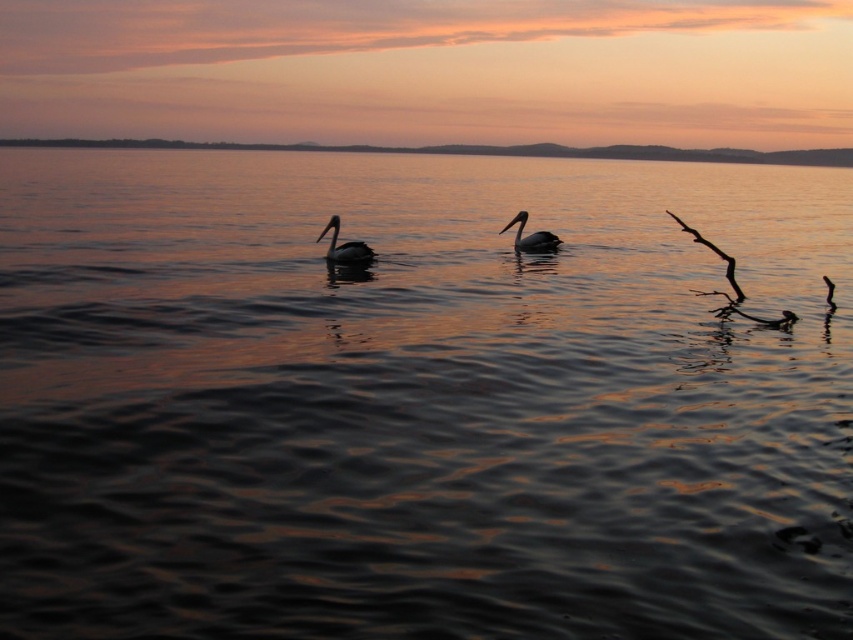
Identify the location of dark gray matte pelican at center. The image size is (853, 640). (344, 246).

Does dark gray matte pelican at center come behind matte gray duck at center?

That is False.

Is point (328, 228) positioned after point (523, 225)?

No, (328, 228) is in front of (523, 225).

Where is `dark gray matte pelican at center`? dark gray matte pelican at center is located at coordinates (344, 246).